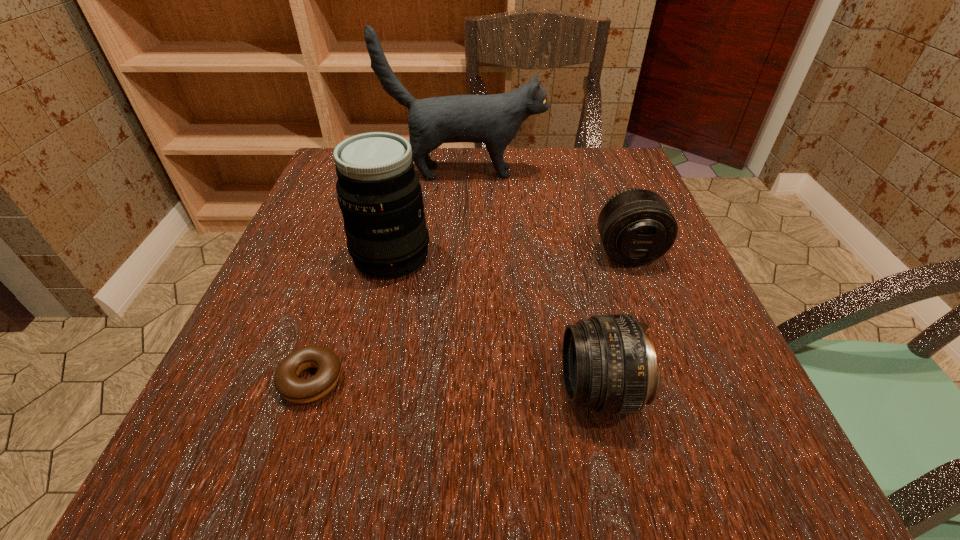
This screenshot has width=960, height=540. I want to click on free point located 0.090m at the front element of the nearest telephoto lens, so click(498, 390).

Locate an element on the screen. The height and width of the screenshot is (540, 960). vacant space located 0.250m on the back of the doughnut is located at coordinates (354, 249).

The height and width of the screenshot is (540, 960). Identify the location of object present at the far edge. (495, 119).

Image resolution: width=960 pixels, height=540 pixels. I want to click on object located at the near edge, so [x=609, y=363].

The height and width of the screenshot is (540, 960). I want to click on cat situated at the left edge, so click(495, 119).

Where is `telephoto lens located in the left edge section of the desktop`? telephoto lens located in the left edge section of the desktop is located at coordinates click(379, 193).

Identify the location of doughnut positioned at the left edge. (287, 382).

This screenshot has width=960, height=540. In order to click on object that is at the far left corner in this screenshot , I will do `click(495, 119)`.

The width and height of the screenshot is (960, 540). Identify the location of object that is at the near right corner. (609, 363).

Find the location of `blank space at the far edge of the desktop`. blank space at the far edge of the desktop is located at coordinates (470, 156).